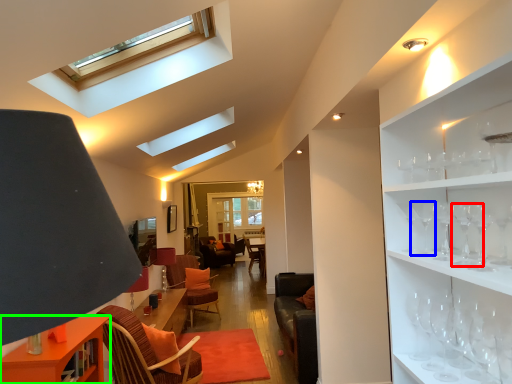
Question: Based on their relative distances, which object is nearer to wine glass (highlighted by a red box)? Choose from wine glass (highlighted by a blue box) and table (highlighted by a green box).

Choices:
 (A) wine glass
 (B) table

Answer: (A)